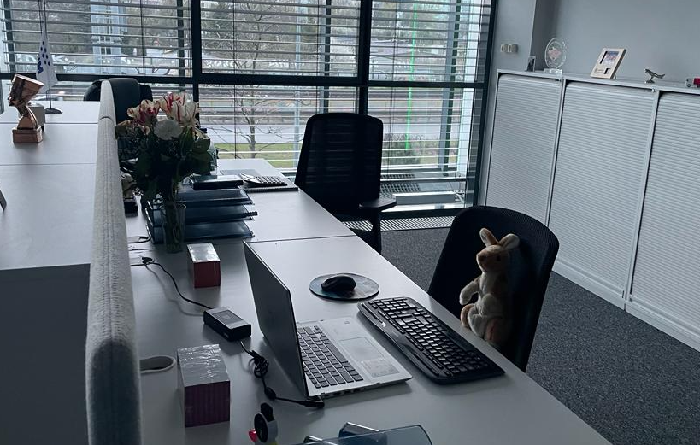
Find the location of a particular element. 1 picture frame is located at coordinates (614, 64).